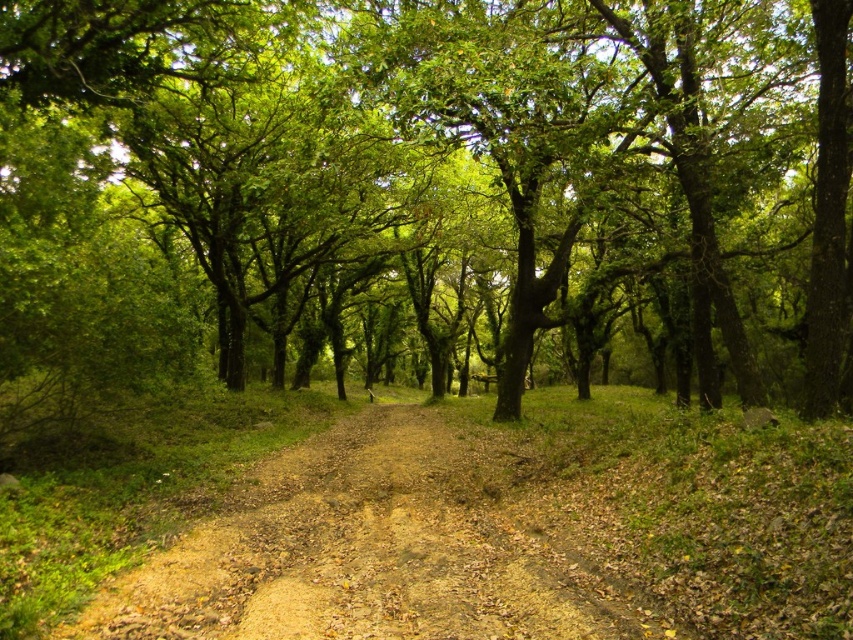
Between green leafy tree at center and brown dirt track at center, which one appears on the left side from the viewer's perspective?

Positioned to the left is green leafy tree at center.

Is point (3, 435) farther from viewer compared to point (231, 632)?

Yes, it is.

Which is in front, point (109, 4) or point (529, 547)?

Point (529, 547) is more forward.

The width and height of the screenshot is (853, 640). What are the coordinates of `green leafy tree at center` in the screenshot? It's located at (425, 188).